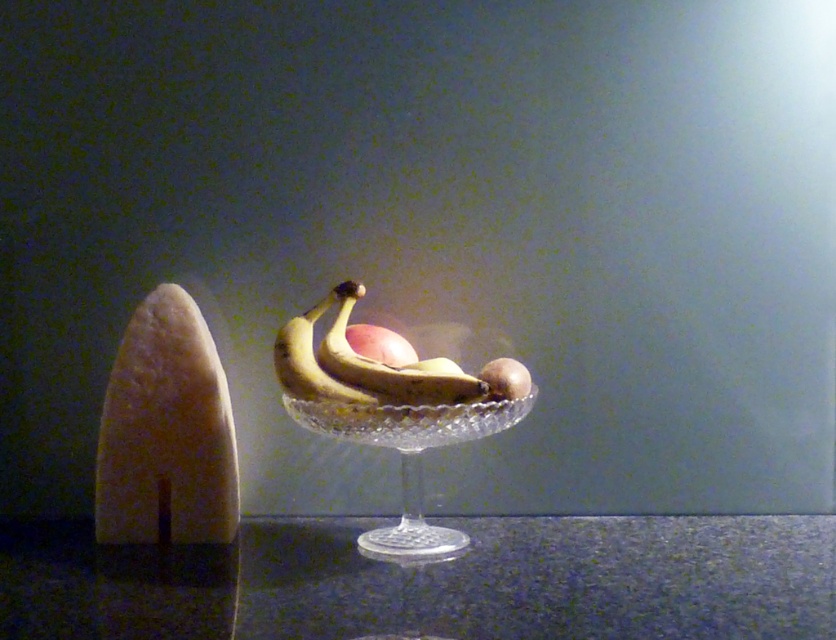
You are arranging a still life setup and need to place a small vase between the granite table at center and the clear glass bowl at center. Based on their positions, which object should the vase be closer to?

The vase should be placed closer to the clear glass bowl at center because the granite table at center is in front of the clear glass bowl at center, meaning the bowl is further back. Placing the vase between them would require positioning it nearer to the bowl to maintain balance.